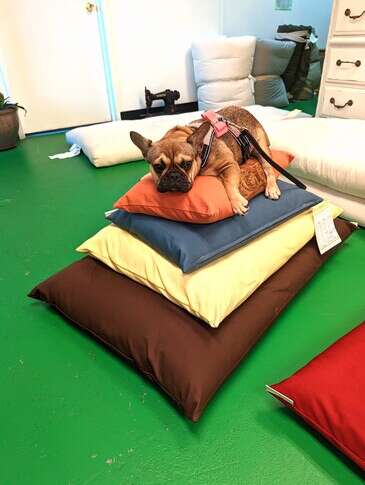
Identify the location of sewing machine. (169, 96).